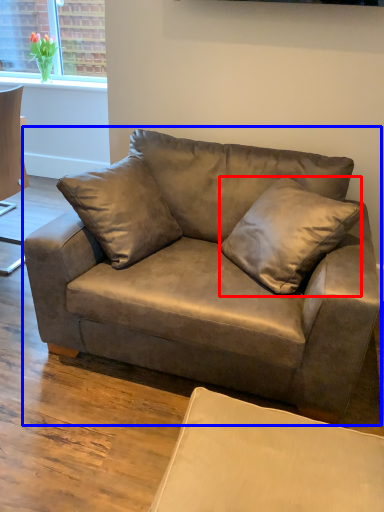
Question: Which of the following is the closest to the observer, pillow (highlighted by a red box) or studio couch (highlighted by a blue box)?

Choices:
 (A) pillow
 (B) studio couch

Answer: (B)